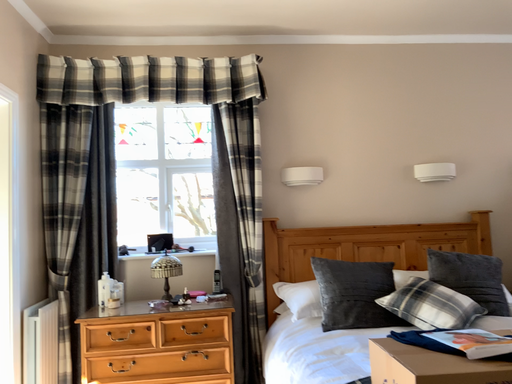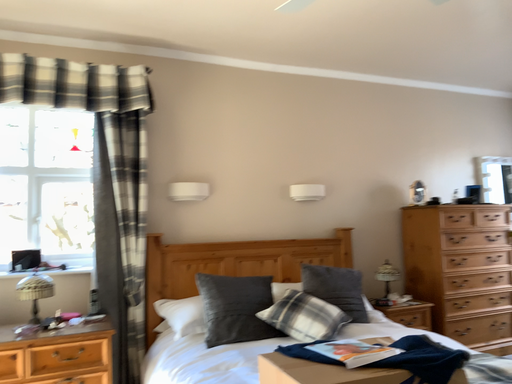
Question: Which way did the camera rotate in the video?

Choices:
 (A) rotated left
 (B) rotated right

Answer: (B)